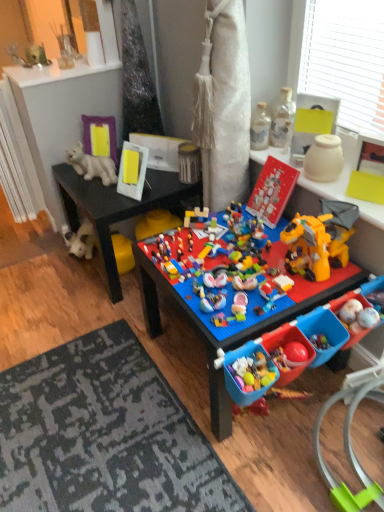
Identify the location of free space above blue plastic table at center (from a real-world perspective). (231, 261).